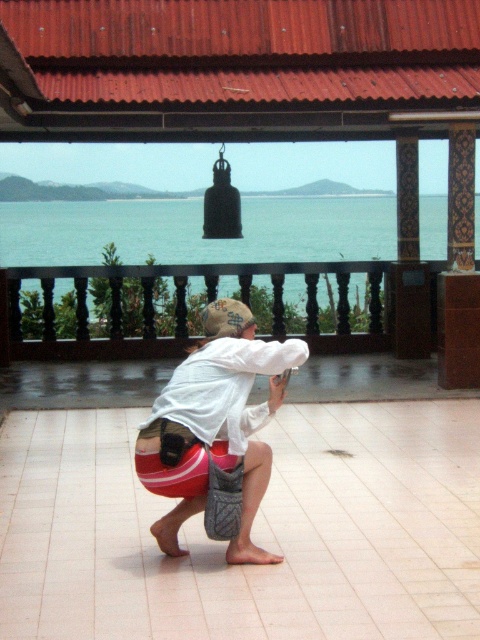
Which of these two, blue water at center or red fabric bag at center, stands taller?

blue water at center is taller.

Consider the image. Can you confirm if blue water at center is shorter than red fabric bag at center?

In fact, blue water at center may be taller than red fabric bag at center.

You are a GUI agent. You are given a task and a screenshot of the screen. Output one action in this format:
    pyautogui.click(x=<x>, y=<y>)
    Task: Click on the blue water at center
    
    Given the screenshot: What is the action you would take?
    pyautogui.click(x=197, y=230)